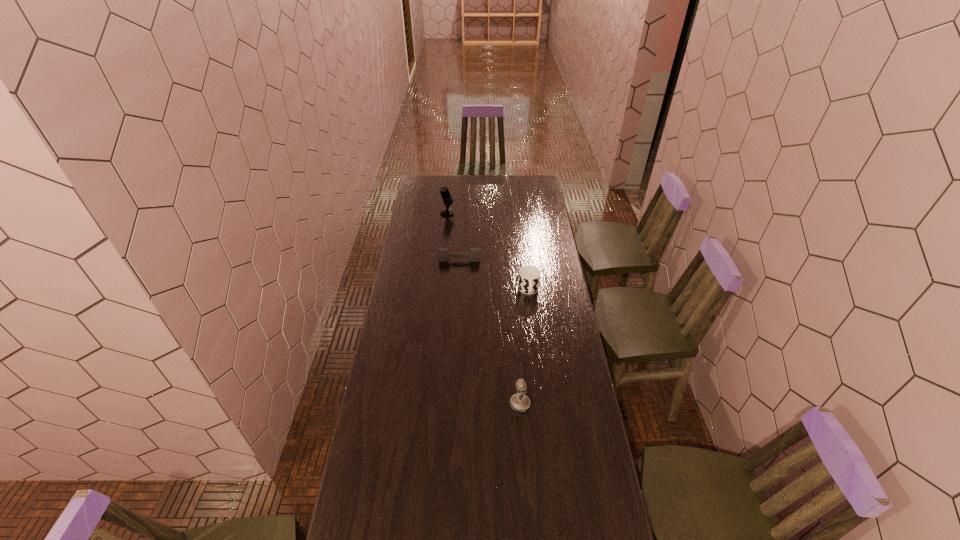
Image resolution: width=960 pixels, height=540 pixels. Identify the location of the farthest object. (446, 196).

Locate an element on the screen. Image resolution: width=960 pixels, height=540 pixels. the farther microphone is located at coordinates click(x=446, y=196).

Identify the location of the nearer microphone. The image size is (960, 540). (519, 402).

I want to click on the nearest object, so click(x=519, y=402).

Identify the location of the second nearest object. (529, 276).

Locate an element on the screen. The image size is (960, 540). the third tallest object is located at coordinates (529, 276).

You are a GUI agent. You are given a task and a screenshot of the screen. Output one action in this format:
    pyautogui.click(x=<x>, y=<y>)
    Task: Click on the shortest object
    The image size is (960, 540).
    Given the screenshot: What is the action you would take?
    pyautogui.click(x=443, y=253)

Where is `the second farthest object`? The height and width of the screenshot is (540, 960). the second farthest object is located at coordinates (443, 253).

This screenshot has height=540, width=960. Find the location of `vacant space situated on the stand of the left microphone`. vacant space situated on the stand of the left microphone is located at coordinates (496, 213).

Locate an element on the screen. The height and width of the screenshot is (540, 960). vacant space located on the front-facing side of the shorter microphone is located at coordinates (444, 404).